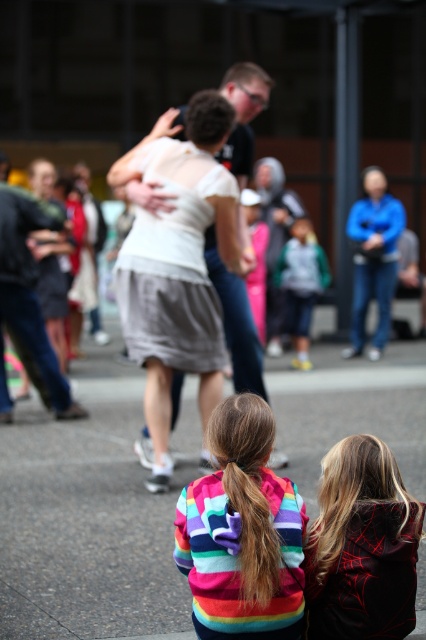
You are a photographer trying to capture a candid shot of the dark red hoodie at lower right and the matte black jacket at left. Since you want to ensure both subjects are in focus, you need to know which one is closer to the camera. Can you determine which is nearer?

The dark red hoodie at lower right has a lesser height compared to the matte black jacket at left, which indicates it is positioned closer to the camera.

Looking at this image, you are standing at the back of the scene and want to take a photo of the rainbow striped sweater at lower center and the matte black jacket at left. Which object should you adjust your camera angle to focus on first to ensure both are in the frame?

The rainbow striped sweater at lower center is located below the matte black jacket at left. To ensure both are in the frame, adjust your camera angle to focus on the rainbow striped sweater at lower center first, as it is lower and might be out of the initial frame if you start with the higher positioned matte black jacket at left.

You are organizing a charity clothing drive and need to determine which jacket can accommodate a larger person. Based on the image, which jacket between the dark red hoodie at lower right and the matte black jacket at left is more suitable for a bigger individual?

The matte black jacket at left is more suitable for a bigger individual because it has a larger size compared to the dark red hoodie at lower right.